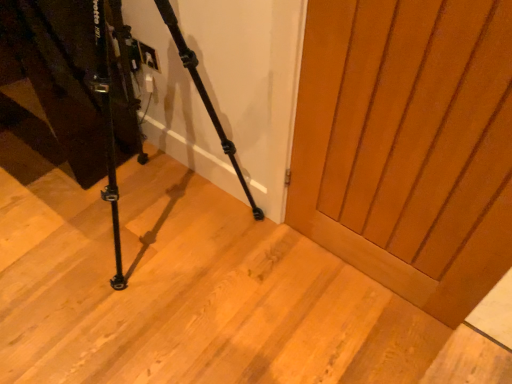
Where is `vacant space in front of matte wood door at center`? vacant space in front of matte wood door at center is located at coordinates (367, 333).